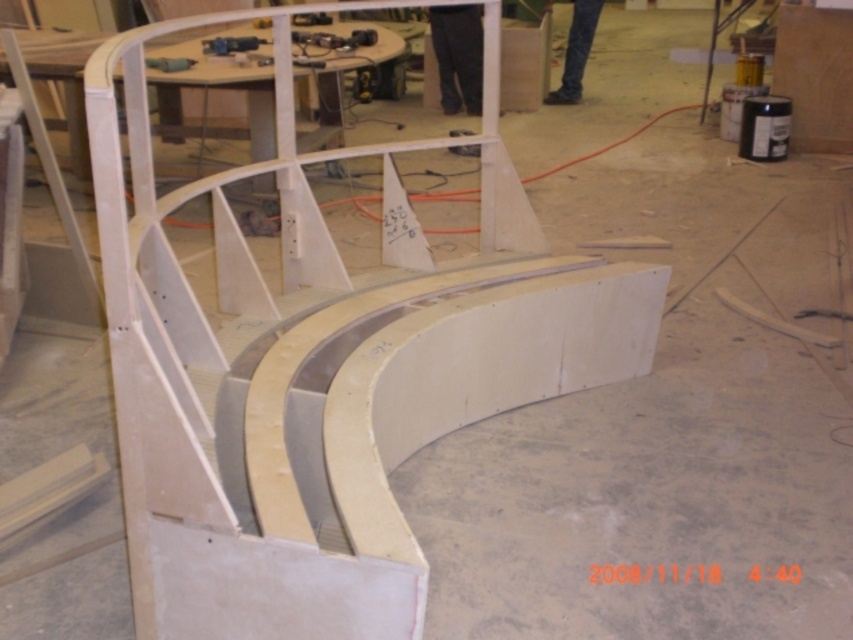
Is blue jeans at center below metallic blue drill at upper center?

No, blue jeans at center is not below metallic blue drill at upper center.

Between point (579, 35) and point (254, 42), which one is positioned behind?

The point (579, 35) is behind.

At what (x,y) coordinates should I click in order to perform the action: click on blue jeans at center. Please return your answer as a coordinate pair (x, y). Looking at the image, I should click on (576, 51).

The image size is (853, 640). Find the location of `blue jeans at center`. blue jeans at center is located at coordinates (576, 51).

Is dark gray pants at center thinner than blue jeans at center?

Yes.

Who is more distant from viewer, (447,68) or (579,36)?

The point (579,36) is behind.

Where is `dark gray pants at center`? dark gray pants at center is located at coordinates (457, 54).

Does dark gray pants at center appear under metallic blue drill at upper center?

Incorrect, dark gray pants at center is not positioned below metallic blue drill at upper center.

Is point (451, 112) positioned behind point (219, 52)?

Yes, point (451, 112) is farther from viewer.

Between point (459, 77) and point (247, 44), which one is positioned behind?

The point (459, 77) is behind.

Image resolution: width=853 pixels, height=640 pixels. Find the location of `dark gray pants at center`. dark gray pants at center is located at coordinates (457, 54).